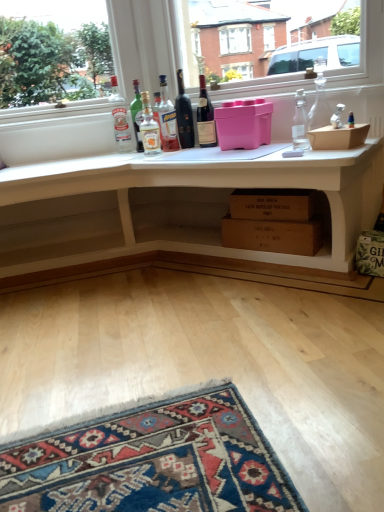
Identify the location of free region on the left part of clear glass bottle at upper right, which ranks as the 6th bottle in left-to-right order. This screenshot has width=384, height=512. (258, 156).